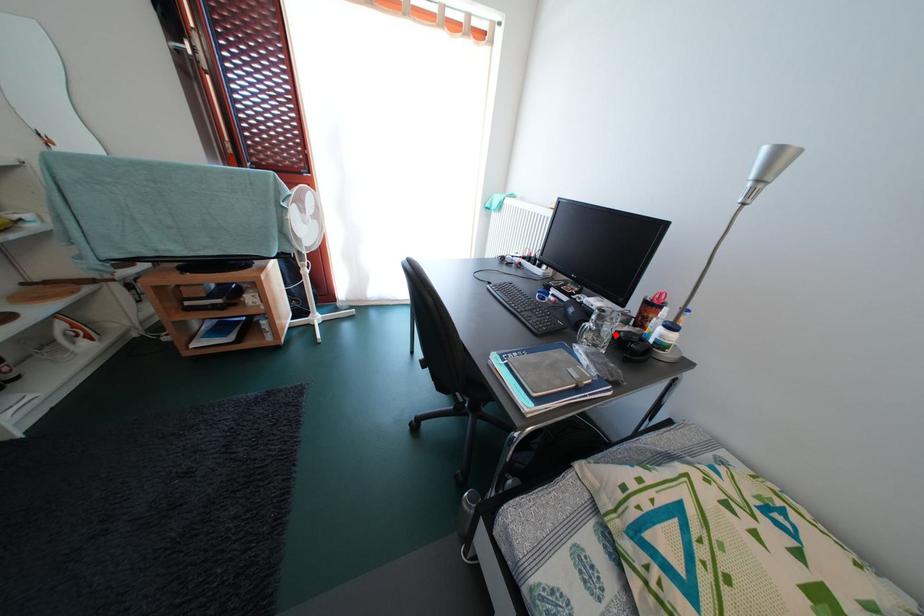
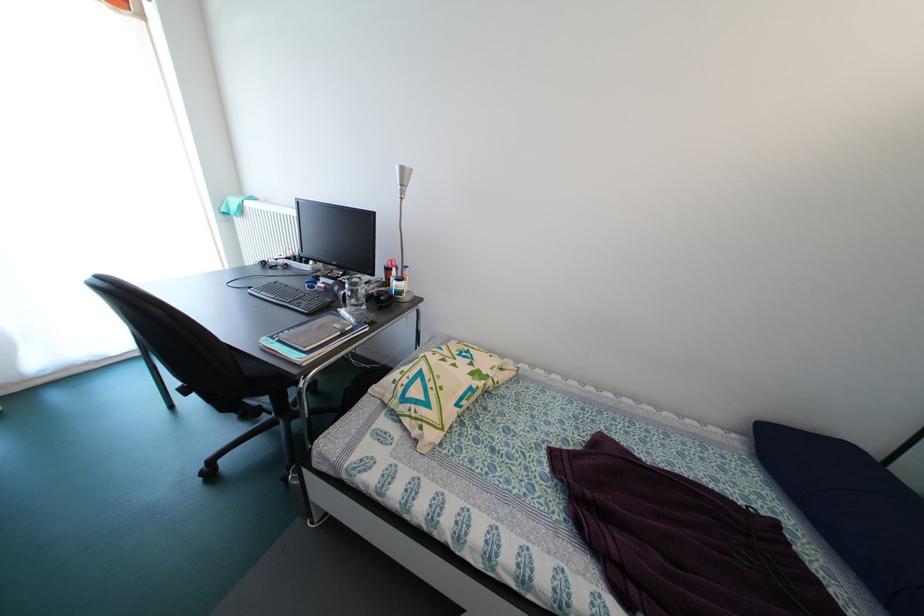
In the second image, find the point that corresponds to the highlighted location in the first image.

(369, 297)